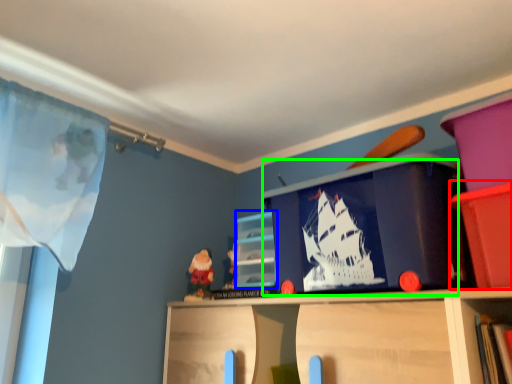
Question: Based on their relative distances, which object is nearer to cabinet (highlighted by a red box)? Choose from cabinet (highlighted by a blue box) and window screen (highlighted by a green box).

Choices:
 (A) cabinet
 (B) window screen

Answer: (B)